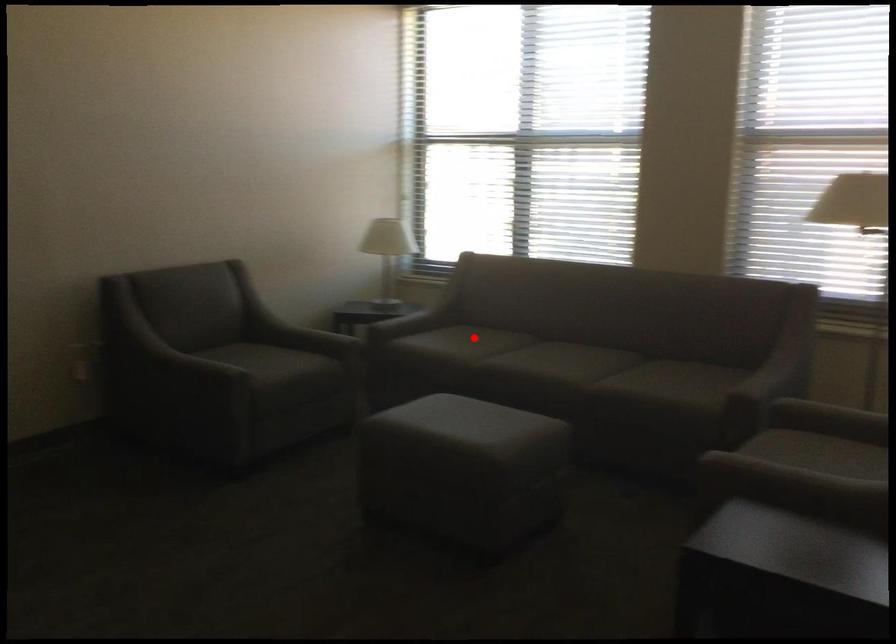
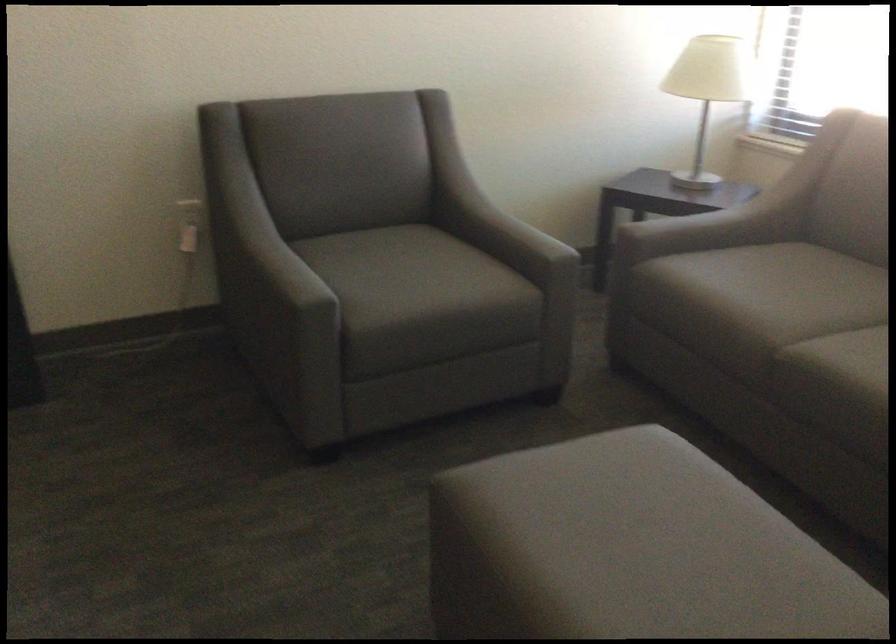
Question: I am providing you with two images of the same scene from different viewpoints. A red point is shown in image1. For the corresponding object point in image2, is it positioned nearer or farther from the camera?

Choices:
 (A) Nearer
 (B) Farther

Answer: (A)